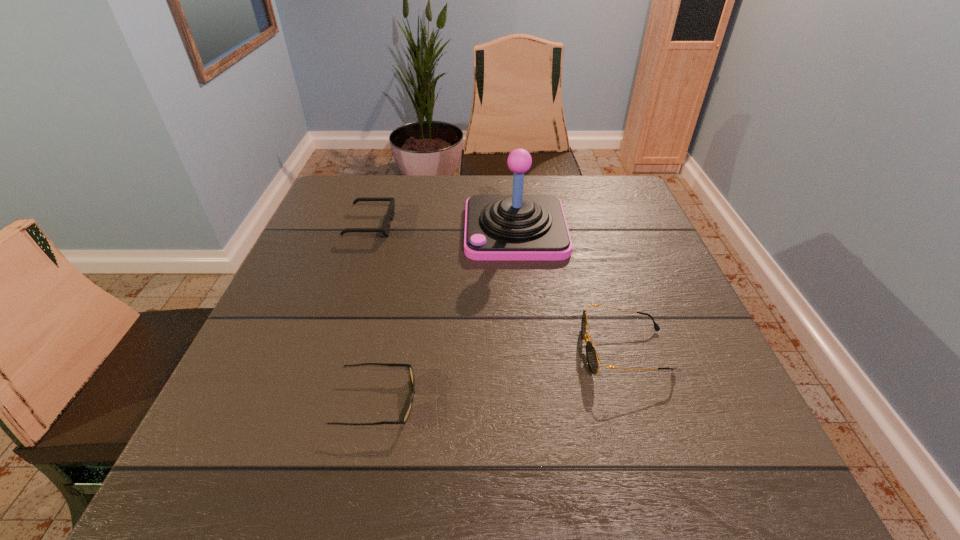
Select which sunglasses appears as the second closest to the farthest sunglasses. Please provide its 2D coordinates. Your answer should be formatted as a tuple, i.e. [(x, y)], where the tuple contains the x and y coordinates of a point satisfying the conditions above.

[(592, 358)]